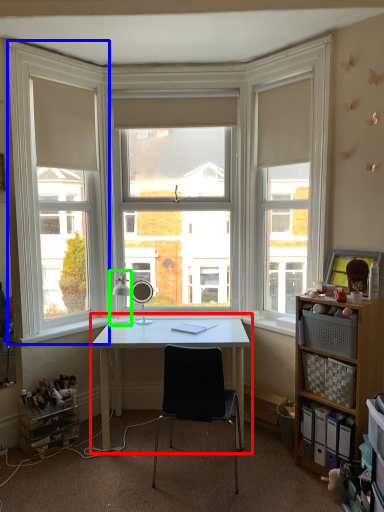
Question: Based on their relative distances, which object is nearer to desk (highlighted by a red box)? Choose from window frame (highlighted by a blue box) and table lamp (highlighted by a green box).

Choices:
 (A) window frame
 (B) table lamp

Answer: (B)